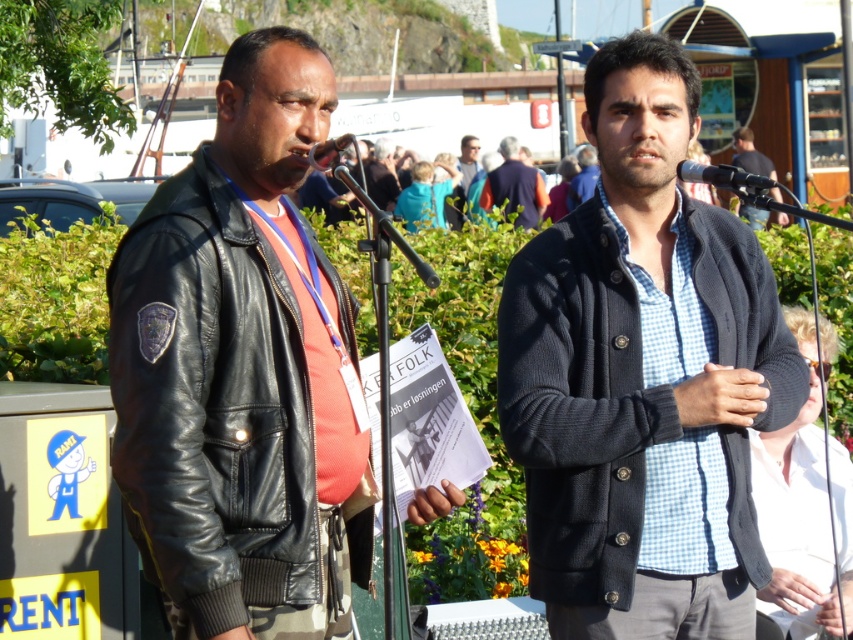
Can you confirm if light brown leather jacket at center is positioned below black leather jacket at upper center?

Yes, light brown leather jacket at center is below black leather jacket at upper center.

The image size is (853, 640). What are the coordinates of `light brown leather jacket at center` in the screenshot? It's located at (514, 186).

Find the location of a particular element. The height and width of the screenshot is (640, 853). light brown leather jacket at center is located at coordinates (514, 186).

Where is `knitted dark gray sweater at center`? Image resolution: width=853 pixels, height=640 pixels. knitted dark gray sweater at center is located at coordinates (642, 376).

Who is taller, knitted dark gray sweater at center or metallic silver microphone at center?

With more height is knitted dark gray sweater at center.

Identify the location of knitted dark gray sweater at center. (642, 376).

Which is in front, point (808, 422) or point (323, 170)?

Point (323, 170) is more forward.

Image resolution: width=853 pixels, height=640 pixels. In order to click on white cotton shirt at center in this screenshot , I will do `click(798, 499)`.

The height and width of the screenshot is (640, 853). What do you see at coordinates (798, 499) in the screenshot?
I see `white cotton shirt at center` at bounding box center [798, 499].

This screenshot has height=640, width=853. Find the location of `white cotton shirt at center`. white cotton shirt at center is located at coordinates (798, 499).